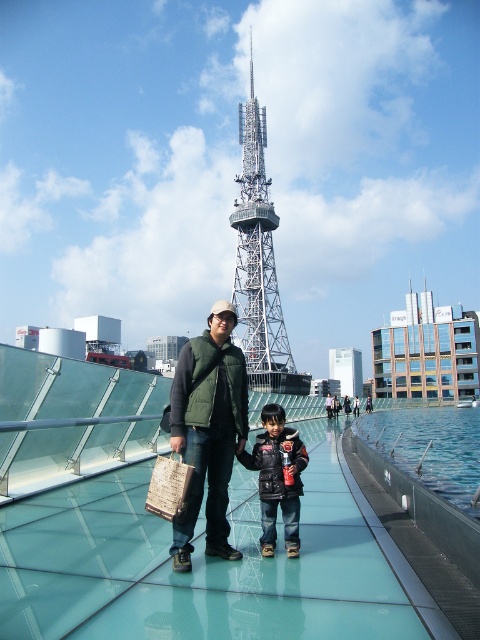
You are a photographer positioned to the side of the glass walkway. You want to capture both the green fabric vest at center and the black leather jacket at center in a single frame. Based on their positions, which object is more likely to be fully visible in the photo?

The green fabric vest at center is wider than the black leather jacket at center, so it is more likely to be fully visible in the photo.

Looking at this image, you are a fashion designer observing two people at the glass walkway. You notice the green fabric vest at center and the black leather jacket at center. Which clothing item is positioned higher on the person wearing it?

The green fabric vest at center is above the black leather jacket at center, so the green fabric vest at center is positioned higher on the person wearing it.

You are taking a photo of the scene and want to ensure both the green fabric vest at center and the metallic lattice tower at center are in focus. Which object should you adjust your camera focus to first to ensure the closest one is sharp?

The green fabric vest at center is closer to the viewer than the metallic lattice tower at center, so you should focus on the green fabric vest at center first to ensure it is sharp before adjusting for the metallic lattice tower at center.